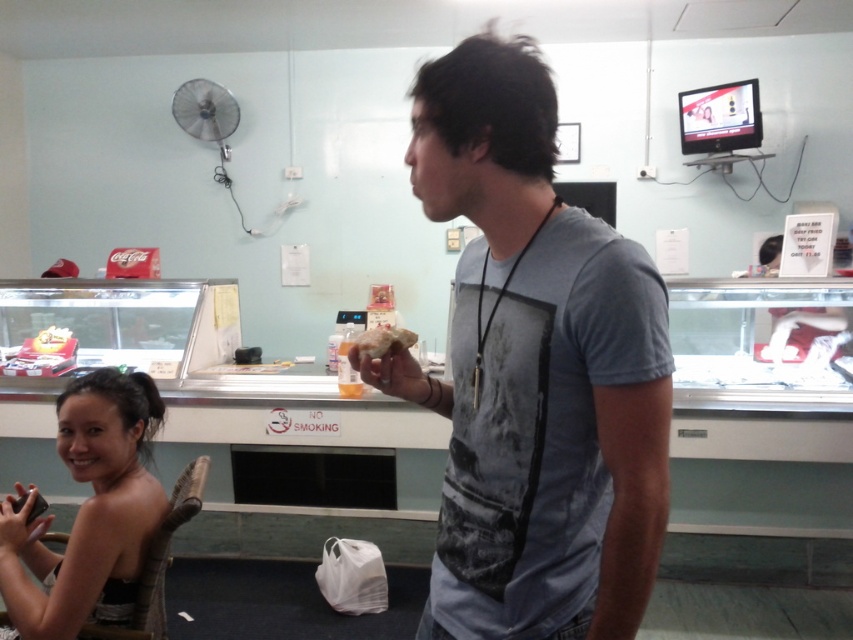
Is smooth black hair at lower left to the right of brown crumbly bread at center from the viewer's perspective?

No, smooth black hair at lower left is not to the right of brown crumbly bread at center.

Measure the distance between point (30, 580) and camera.

4.80 feet

Locate an element on the screen. smooth black hair at lower left is located at coordinates pos(88,512).

Is gray matte t-shirt at center further to the viewer compared to matte yellow cake at center?

No, gray matte t-shirt at center is in front of matte yellow cake at center.

Is gray matte t-shirt at center wider than matte yellow cake at center?

Correct, the width of gray matte t-shirt at center exceeds that of matte yellow cake at center.

Does point (612, 500) lie in front of point (65, 340)?

Yes, point (612, 500) is in front of point (65, 340).

This screenshot has width=853, height=640. I want to click on gray matte t-shirt at center, so [x=534, y=371].

Between gray matte t-shirt at center and smooth black hair at lower left, which one appears on the right side from the viewer's perspective?

gray matte t-shirt at center is more to the right.

What do you see at coordinates (534, 371) in the screenshot? Image resolution: width=853 pixels, height=640 pixels. I see `gray matte t-shirt at center` at bounding box center [534, 371].

Find the location of a particular element. gray matte t-shirt at center is located at coordinates (534, 371).